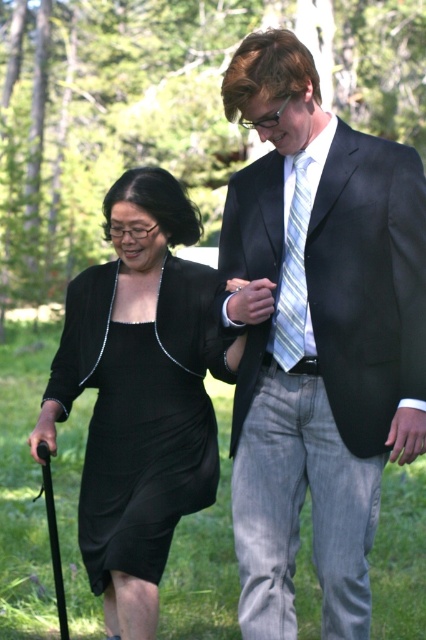
Does matte black suit at center appear on the left side of striped fabric tie at center?

In fact, matte black suit at center is to the right of striped fabric tie at center.

Between matte black suit at center and striped fabric tie at center, which one appears on the right side from the viewer's perspective?

Positioned to the right is matte black suit at center.

Is point (253, 186) farther from viewer compared to point (290, 211)?

Yes, point (253, 186) is farther from viewer.

At what (x,y) coordinates should I click in order to perform the action: click on matte black suit at center. Please return your answer as a coordinate pair (x, y). The height and width of the screenshot is (640, 426). Looking at the image, I should click on (319, 337).

Who is positioned more to the left, matte black suit at center or black satin dress at left?

From the viewer's perspective, black satin dress at left appears more on the left side.

Does matte black suit at center appear over black satin dress at left?

Yes.

Between point (282, 218) and point (149, 536), which one is positioned behind?

Positioned behind is point (149, 536).

This screenshot has height=640, width=426. What are the coordinates of `matte black suit at center` in the screenshot? It's located at (319, 337).

Is black satin dress at left in front of striped fabric tie at center?

No, it is not.

Describe the element at coordinates (141, 394) in the screenshot. The width and height of the screenshot is (426, 640). I see `black satin dress at left` at that location.

You are a GUI agent. You are given a task and a screenshot of the screen. Output one action in this format:
    pyautogui.click(x=<x>, y=<y>)
    Task: Click on the black satin dress at left
    The image size is (426, 640).
    Given the screenshot: What is the action you would take?
    (x=141, y=394)

This screenshot has width=426, height=640. What are the coordinates of `black satin dress at left` in the screenshot? It's located at (141, 394).